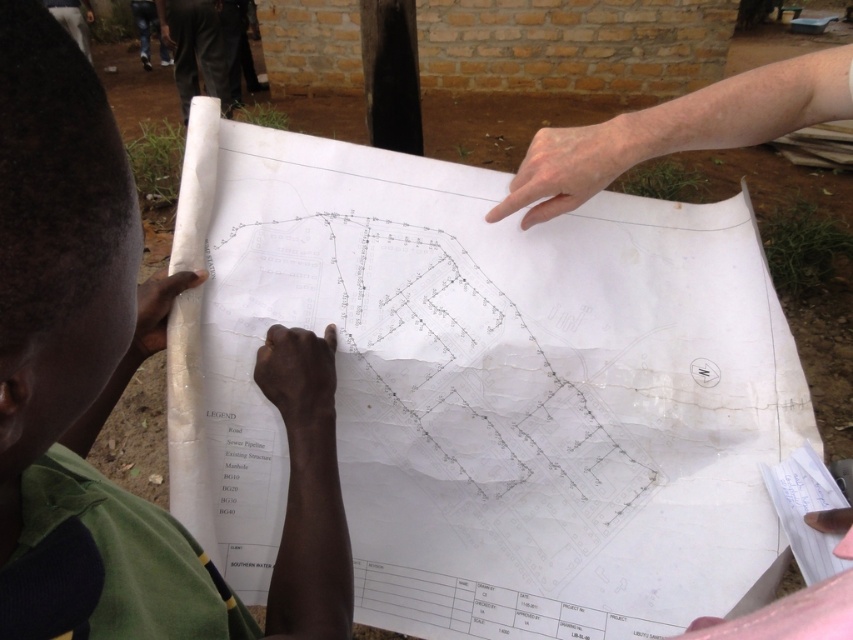
Question: Can you confirm if green fabric shirt at lower left is thinner than black fabric pants at upper left?

Choices:
 (A) yes
 (B) no

Answer: (A)

Question: Which point is farther to the camera?

Choices:
 (A) black fabric pants at upper left
 (B) green fabric shirt at lower left

Answer: (A)

Question: Is green fabric shirt at lower left positioned behind black fabric pants at upper left?

Choices:
 (A) no
 (B) yes

Answer: (A)

Question: Among these points, which one is farthest from the camera?

Choices:
 (A) (186, 49)
 (B) (120, 298)

Answer: (A)

Question: Which of the following is the farthest from the observer?

Choices:
 (A) (187, 22)
 (B) (200, 560)

Answer: (A)

Question: Observing the image, what is the correct spatial positioning of green fabric shirt at lower left in reference to black fabric pants at upper left?

Choices:
 (A) below
 (B) above

Answer: (A)